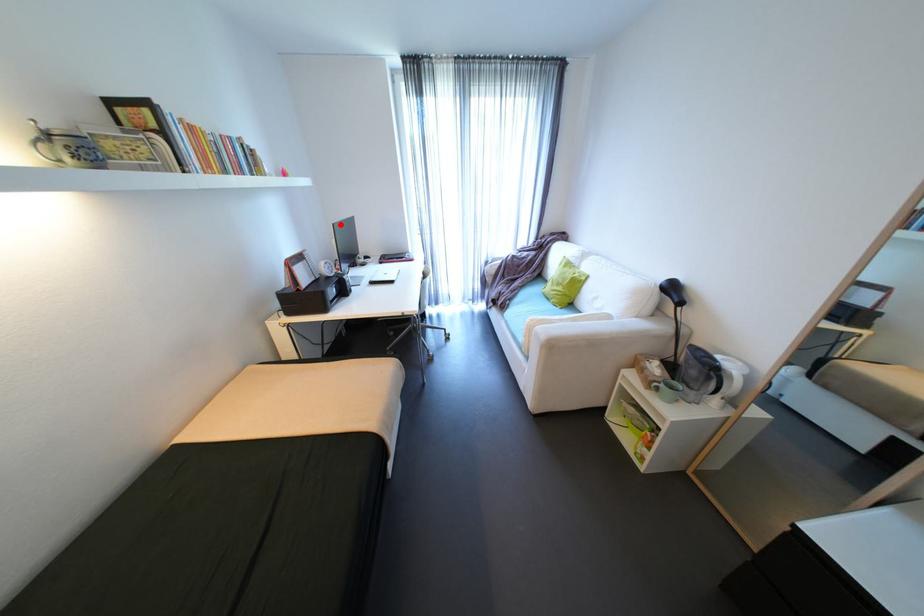
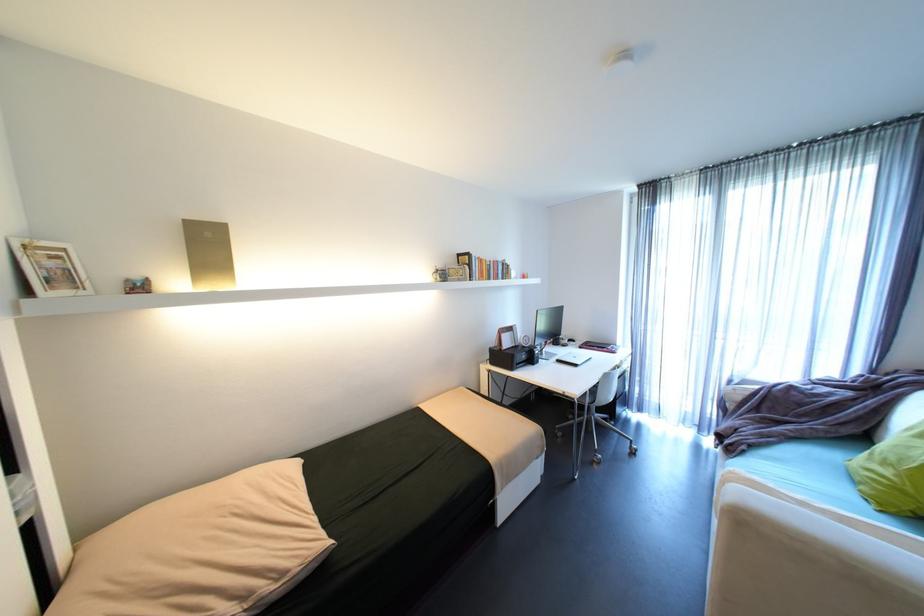
Question: I am providing you with two images of the same scene from different viewpoints. A red point is marked on the first image. Is the red point's position out of view in image 2?

Choices:
 (A) Yes
 (B) No

Answer: (B)